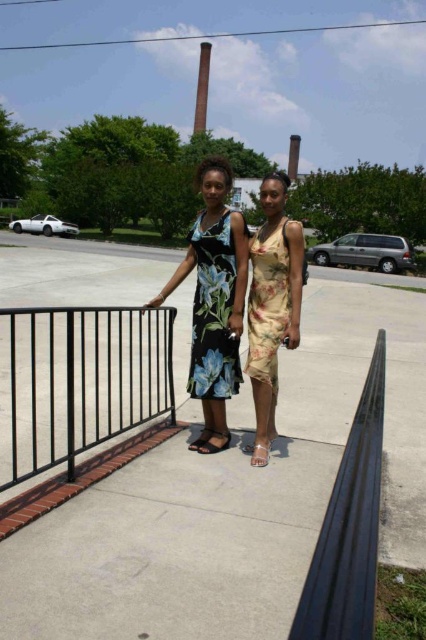
You are a photographer trying to capture a photo of the black metal railing at left and the black floral dress at center. Based on their positions, which object should you focus on first to ensure both are in the frame without moving the camera?

The black metal railing at left is closer to the viewer than the black floral dress at center. To ensure both are in focus, you should focus on the black metal railing at left first, as it is closer, and the depth of field may naturally include the black floral dress at center in the background.

Consider the image. You are a shoe designer observing the scene. You need to determine which sandal to recommend for a client who prefers a larger size. Which sandal between the matte beige sandal at lower center and the black leather sandal at center should you suggest?

The matte beige sandal at lower center is bigger than the black leather sandal at center, so you should recommend the matte beige sandal at lower center for the client who prefers a larger size.